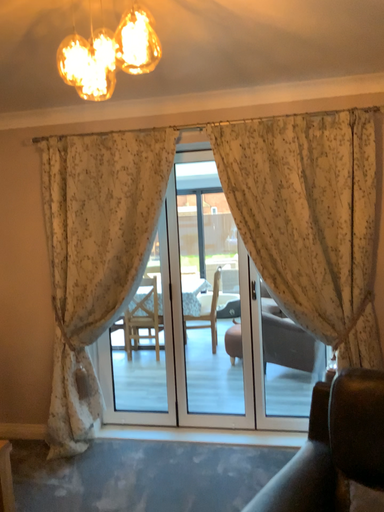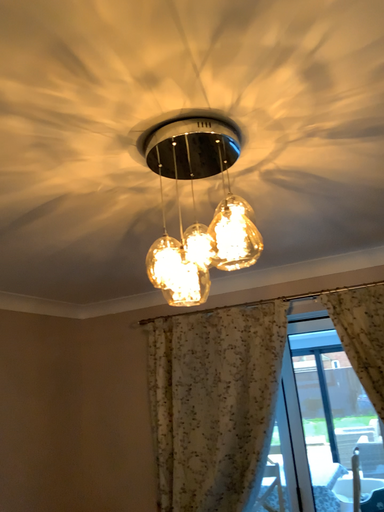
Question: Which way did the camera rotate in the video?

Choices:
 (A) rotated left
 (B) rotated right

Answer: (A)